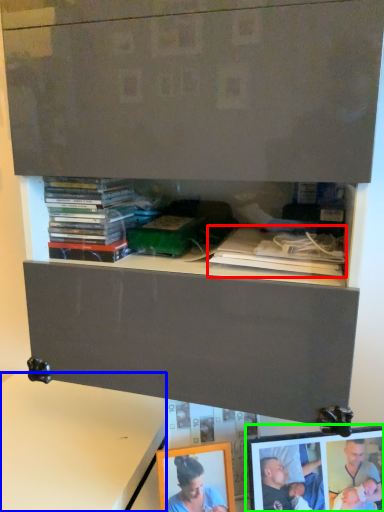
Question: Which is farther away from book (highlighted by a red box)? table (highlighted by a blue box) or picture frame (highlighted by a green box)?

Choices:
 (A) table
 (B) picture frame

Answer: (A)